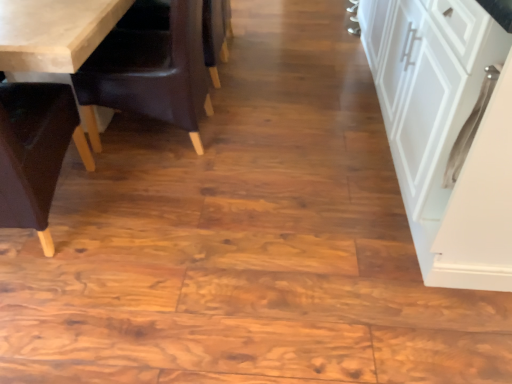
Question: In the image, is white matte cabinet at right positioned in front of or behind brown leather chair at left, placed as the second chair when sorted from left to right?

Choices:
 (A) front
 (B) behind

Answer: (A)

Question: Based on their positions, is white matte cabinet at right located to the left or right of brown leather chair at left, placed as the 1th chair when sorted from right to left?

Choices:
 (A) right
 (B) left

Answer: (A)

Question: Considering the real-world distances, which object is closest to the white matte cabinet at right?

Choices:
 (A) wooden chair at left, the first chair when ordered from left to right
 (B) dark brown leather armchair at center
 (C) brown leather chair at left, placed as the 1th chair when sorted from right to left

Answer: (C)

Question: Based on their relative distances, which object is nearer to the dark brown leather armchair at center?

Choices:
 (A) brown leather chair at left, placed as the second chair when sorted from left to right
 (B) wooden chair at left, the first chair when ordered from left to right
 (C) white matte cabinet at right

Answer: (A)